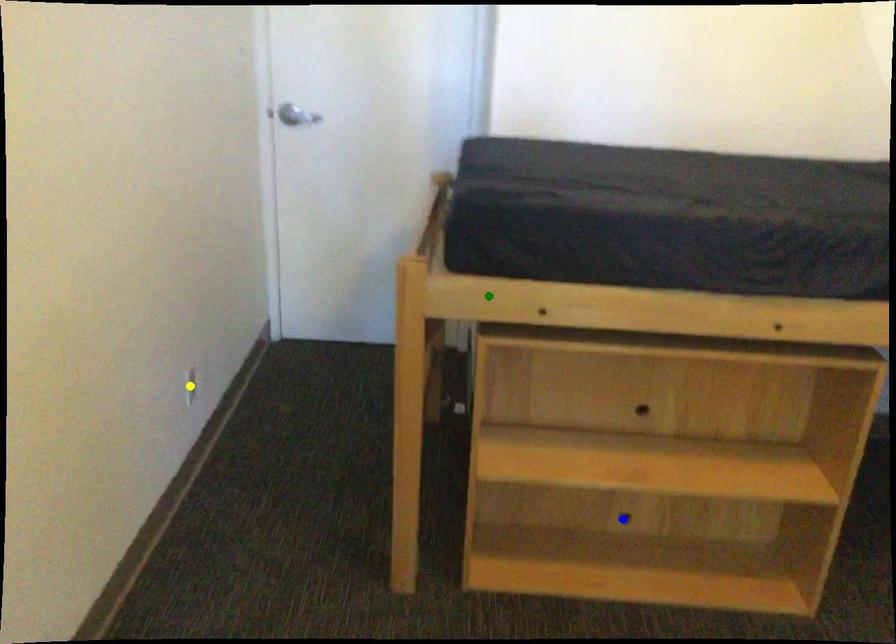
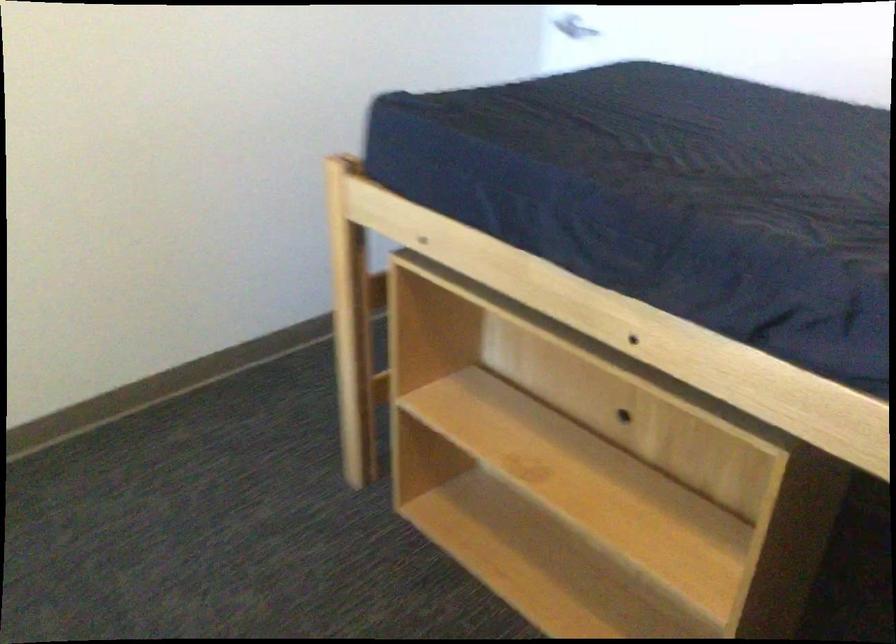
I am providing you with two images of the same scene from different viewpoints. Three points are marked in image1. Which point corresponds to a part or object that is occluded in image2?In image1, three points are marked. Which of them correspond to a part or object that is occluded in image2?Among the three points shown in image1, which one corresponds to a part or object that is no longer visible due to occlusion in image2?

blue point, yellow point